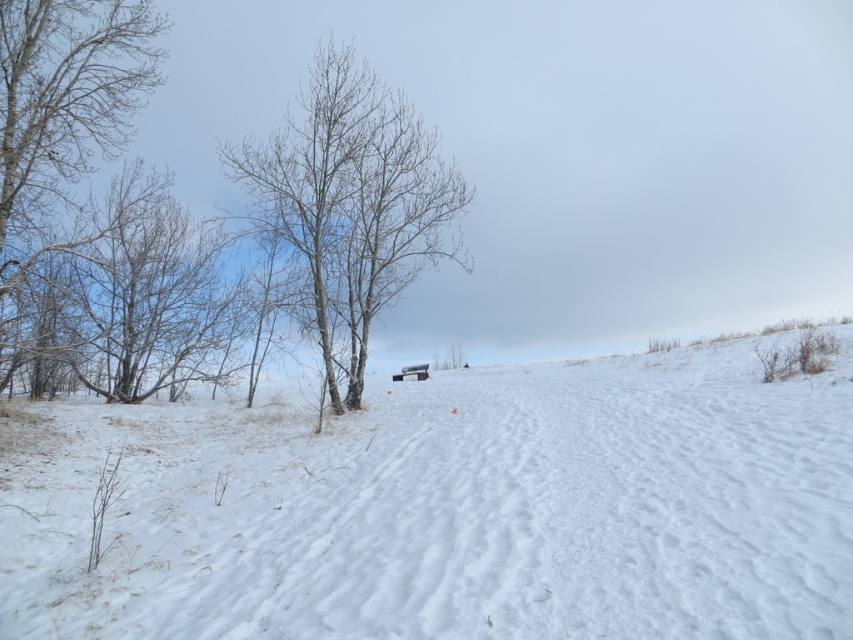
You are standing in the winter landscape and want to walk from point A to point B. Point A is at coordinate point [619,508] and point B is at coordinate point [0,52]. Which point is closer to you when you start walking?

Point A at coordinate point [619,508] is closer to you than point B at coordinate point [0,52], so you will start walking from the closer point first.

You are a skier planning to descend from the top of the white snow ski slope at center. Based on the coordinates provided, can you determine the direction you should head to reach the bottom of the slope?

The white snow ski slope at center is located at coordinates point (448,508). To reach the bottom, you should head in the direction where the y coordinate decreases, as slopes typically descend in that direction.